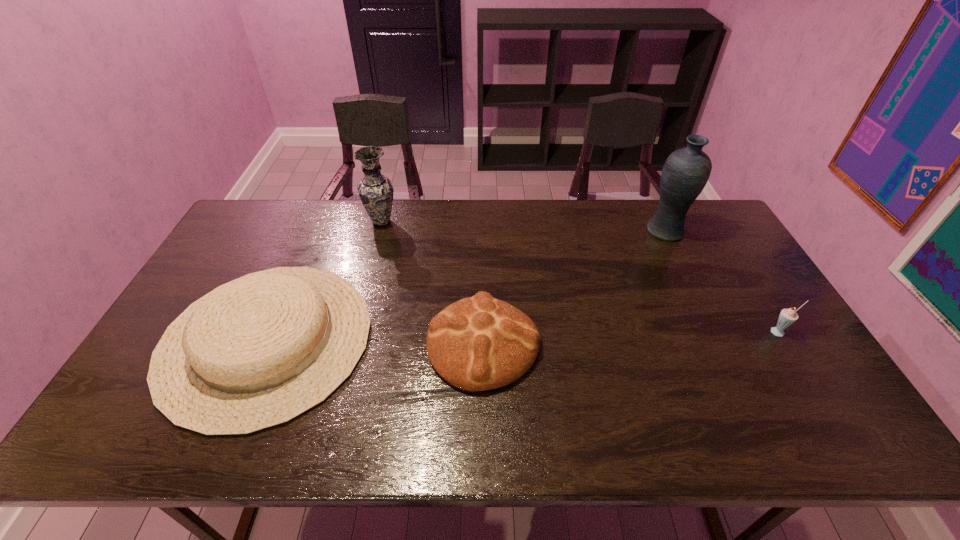
Find the location of a particular element. This screenshot has width=960, height=540. object that is the fourth closest to the left vase is located at coordinates (787, 317).

Locate an element on the screen. This screenshot has width=960, height=540. the closest object relative to the milkshake is located at coordinates (686, 171).

Identify the location of free spot that satisfies the following two spatial constraints: 1. on the front side of the third object from left to right; 2. on the right side of the sunhat. Image resolution: width=960 pixels, height=540 pixels. (265, 344).

You are a GUI agent. You are given a task and a screenshot of the screen. Output one action in this format:
    pyautogui.click(x=<x>, y=<y>)
    Task: Click on the vacant space that satisfies the following two spatial constraints: 1. on the front side of the taller vase; 2. on the left side of the left vase
    The width and height of the screenshot is (960, 540).
    Given the screenshot: What is the action you would take?
    pyautogui.click(x=379, y=232)

Find the location of `vacant region that satisfies the following two spatial constraints: 1. on the back side of the third object from right to left; 2. on the right side of the tallest object`. vacant region that satisfies the following two spatial constraints: 1. on the back side of the third object from right to left; 2. on the right side of the tallest object is located at coordinates (483, 232).